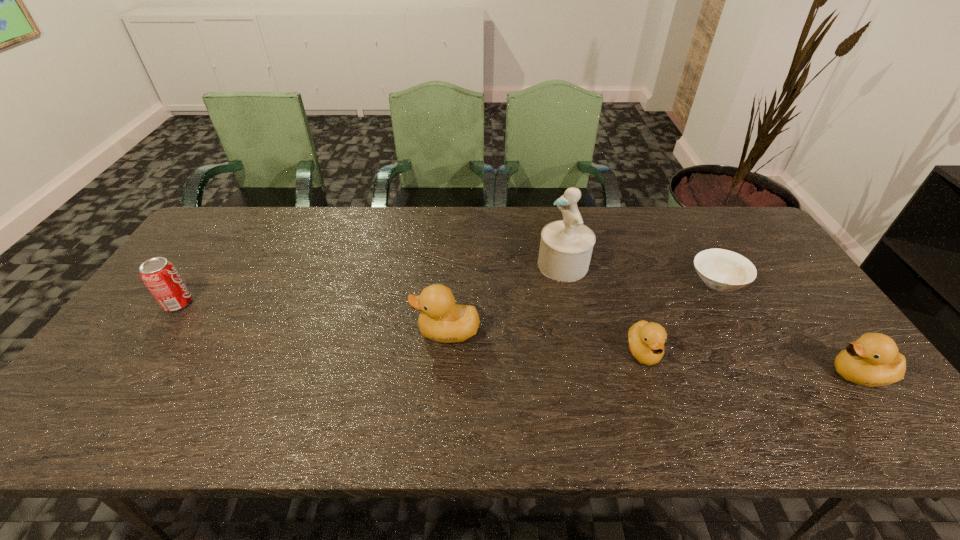
Where is `the leftmost duckling`? the leftmost duckling is located at coordinates (441, 320).

Identify the location of the fifth tallest object. (646, 340).

Image resolution: width=960 pixels, height=540 pixels. What are the coordinates of `the second duckling from right to left` in the screenshot? It's located at (646, 340).

This screenshot has width=960, height=540. Find the location of `the second tallest duckling`. the second tallest duckling is located at coordinates (873, 359).

Locate an element on the screen. the rightmost object is located at coordinates (873, 359).

Where is `the fourth object from right to left`? the fourth object from right to left is located at coordinates [566, 246].

Find the location of a particular element. This screenshot has height=540, width=960. the tallest object is located at coordinates (566, 246).

You are a GUI agent. You are given a task and a screenshot of the screen. Output one action in this format:
    pyautogui.click(x=<x>, y=<y>)
    Task: Click on the leftmost object
    This screenshot has width=960, height=540.
    Given the screenshot: What is the action you would take?
    (x=160, y=276)

Where is `the fifth object from left to right`? Image resolution: width=960 pixels, height=540 pixels. the fifth object from left to right is located at coordinates (722, 270).

The image size is (960, 540). I want to click on bowl, so click(722, 270).